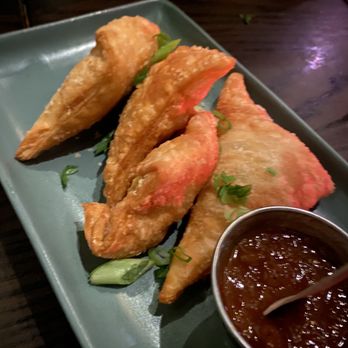
This screenshot has height=348, width=348. What are the coordinates of `spoon` in the screenshot? It's located at (276, 303).